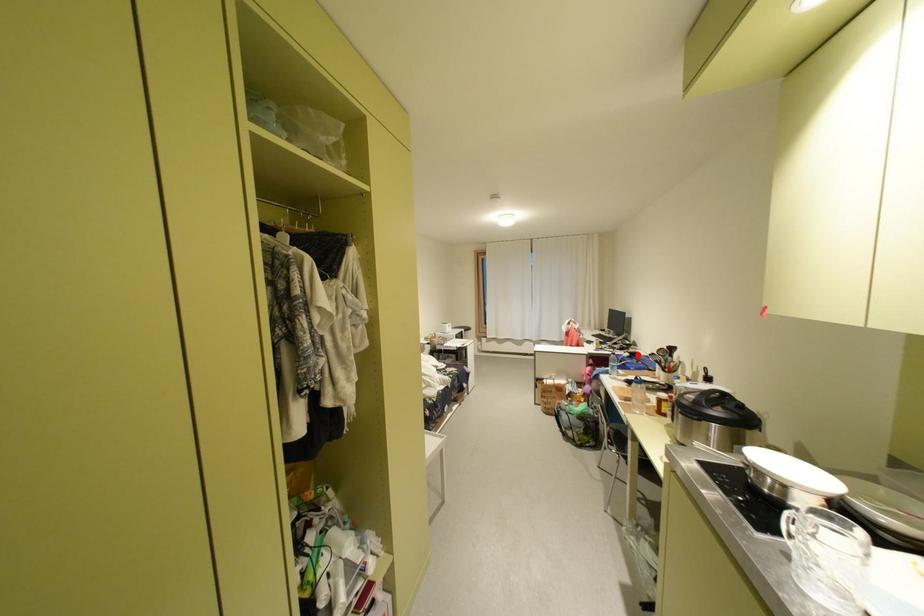
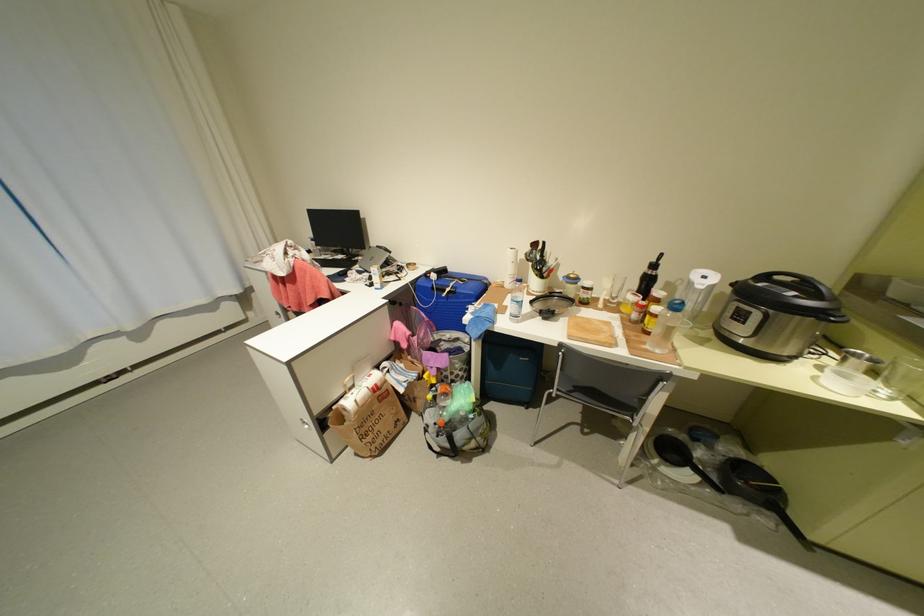
Locate, in the second image, the point that corresponds to the highlighted location in the first image.

(444, 276)